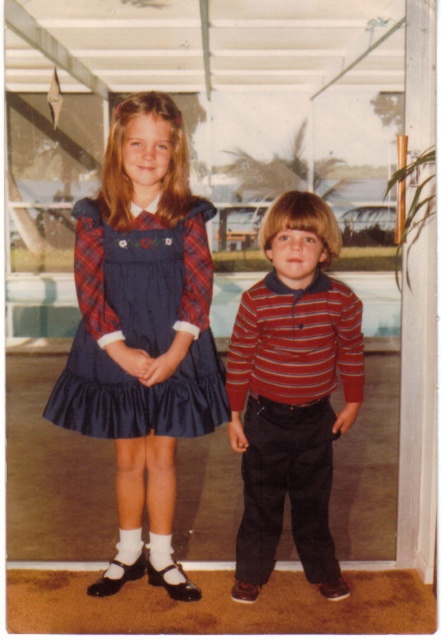
Question: Which object is the farthest from the matte blue dress at center?

Choices:
 (A) striped cotton shirt at center
 (B) navy satin dress at center

Answer: (A)

Question: In this image, where is matte blue dress at center located relative to striped cotton shirt at center?

Choices:
 (A) above
 (B) below

Answer: (A)

Question: Is striped cotton shirt at center below navy satin dress at center?

Choices:
 (A) yes
 (B) no

Answer: (A)

Question: Which of the following is the farthest from the observer?

Choices:
 (A) (328, 346)
 (B) (198, 220)

Answer: (B)

Question: Which point is farther to the camera?

Choices:
 (A) navy satin dress at center
 (B) matte blue dress at center

Answer: (A)

Question: Can you confirm if matte blue dress at center is smaller than striped cotton shirt at center?

Choices:
 (A) no
 (B) yes

Answer: (A)